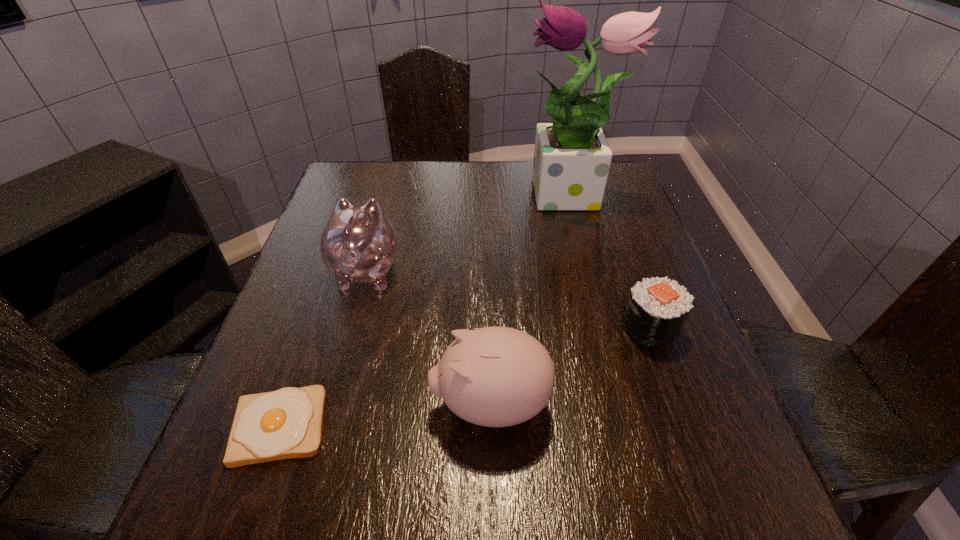
At what (x,y) coordinates should I click in order to perform the action: click on free space that is in between the sushi and the left piggy bank. Please return your answer as a coordinate pair (x, y). The height and width of the screenshot is (540, 960). Looking at the image, I should click on (508, 299).

Identify the location of vacant area that lies between the toast and the right piggy bank. This screenshot has width=960, height=540. (385, 415).

Image resolution: width=960 pixels, height=540 pixels. What are the coordinates of `vacant area that lies between the flower arrangement and the left piggy bank` in the screenshot? It's located at (468, 234).

This screenshot has width=960, height=540. Identify the location of vacant area between the sushi and the nearer piggy bank. (570, 366).

Locate an element on the screen. The height and width of the screenshot is (540, 960). vacant point located between the toast and the left piggy bank is located at coordinates click(324, 348).

The image size is (960, 540). I want to click on free space that is in between the shortest object and the nearer piggy bank, so click(385, 415).

Image resolution: width=960 pixels, height=540 pixels. What are the coordinates of `free space that is in between the flower arrangement and the second shortest object` in the screenshot? It's located at (610, 263).

Where is `vacant point located between the farther piggy bank and the flower arrangement`? vacant point located between the farther piggy bank and the flower arrangement is located at coordinates (468, 234).

You are a GUI agent. You are given a task and a screenshot of the screen. Output one action in this format:
    pyautogui.click(x=<x>, y=<y>)
    Task: Click on the free space between the third farthest object and the farther piggy bank
    The image size is (960, 540).
    Given the screenshot: What is the action you would take?
    pyautogui.click(x=508, y=299)

This screenshot has height=540, width=960. What are the coordinates of `object that is the fourth closest to the third nearest object` in the screenshot? It's located at (287, 423).